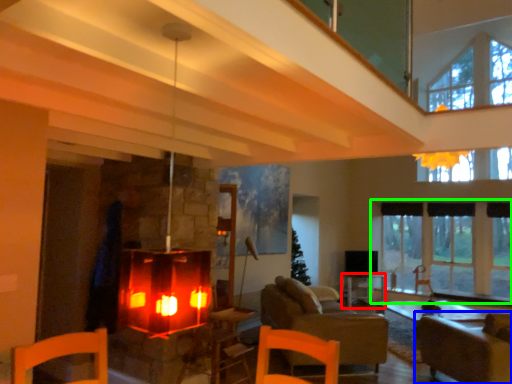
Question: Considering the real-world distances, which object is closest to table (highlighted by a red box)? armchair (highlighted by a blue box) or window (highlighted by a green box).

Choices:
 (A) armchair
 (B) window

Answer: (B)